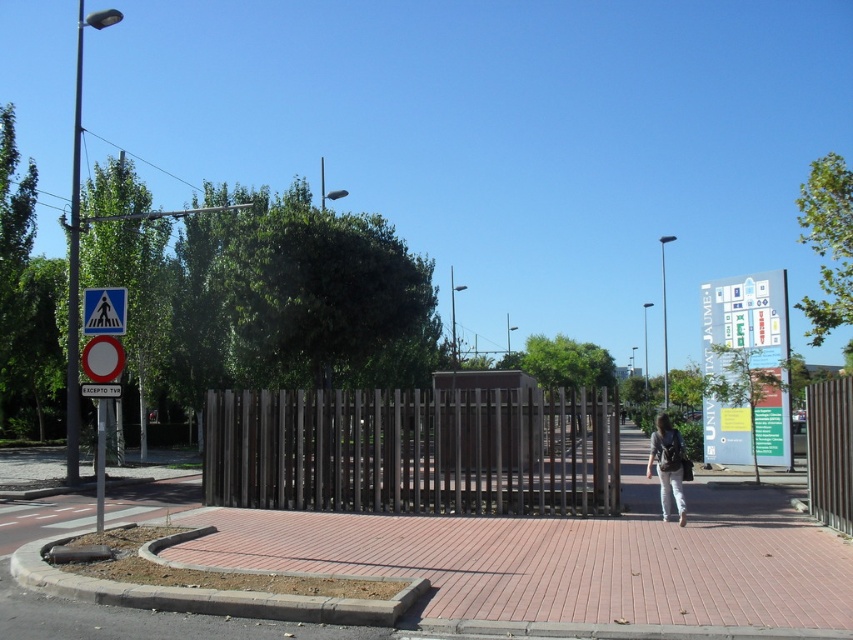
Question: Which point is farther to the camera?

Choices:
 (A) (675, 432)
 (B) (85, 296)
 (C) (444, 468)

Answer: (C)

Question: From the image, what is the correct spatial relationship of brown wooden fence at center in relation to white plastic pedestrian crossing sign at upper left?

Choices:
 (A) right
 (B) left

Answer: (A)

Question: Does brown wooden fence at center appear under white denim pants at center?

Choices:
 (A) no
 (B) yes

Answer: (A)

Question: Based on their relative distances, which object is farther from the brown wooden fence at center?

Choices:
 (A) white denim pants at center
 (B) white plastic pedestrian crossing sign at upper left

Answer: (B)

Question: Which of the following is the farthest from the observer?

Choices:
 (A) (675, 477)
 (B) (103, 291)

Answer: (A)

Question: Is white denim pants at center above white plastic pedestrian crossing sign at upper left?

Choices:
 (A) yes
 (B) no

Answer: (B)